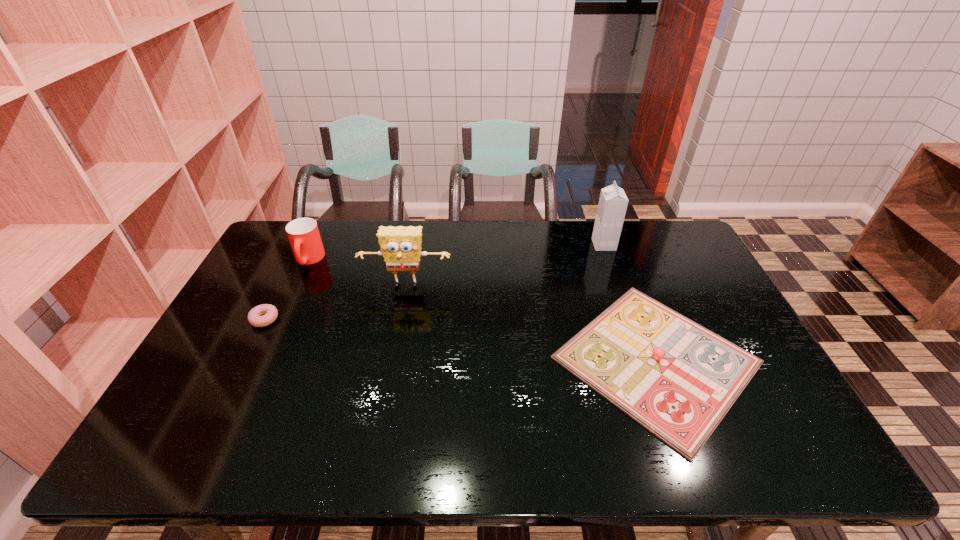
Locate an element on the screen. This screenshot has width=960, height=540. vacant space that satisfies the following two spatial constraints: 1. on the front label of the carton; 2. on the left side of the second shortest object is located at coordinates (644, 360).

The width and height of the screenshot is (960, 540). I want to click on free space that satisfies the following two spatial constraints: 1. on the front label of the carton; 2. on the face of the sponge, so click(618, 287).